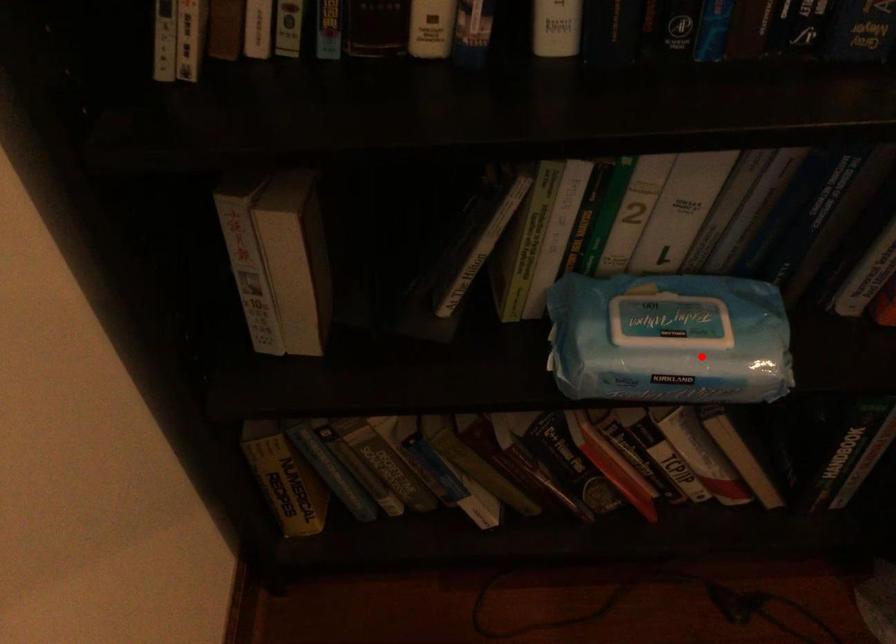
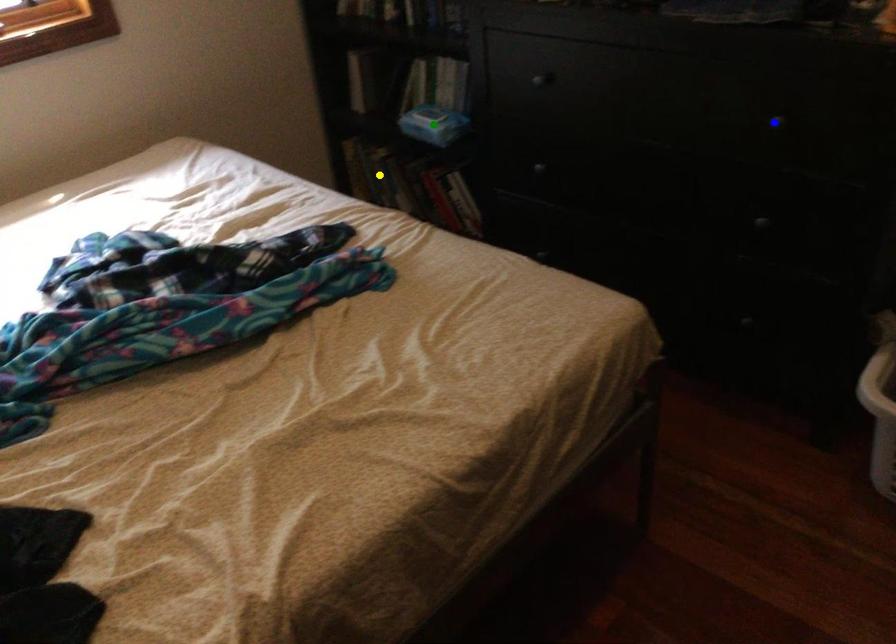
Question: I am providing you with two images of the same scene from different viewpoints. A red point is marked on the first image. You are given multiple points on the second image. Which spot in image 2 lines up with the point in image 1?

Choices:
 (A) green point
 (B) yellow point
 (C) blue point

Answer: (A)